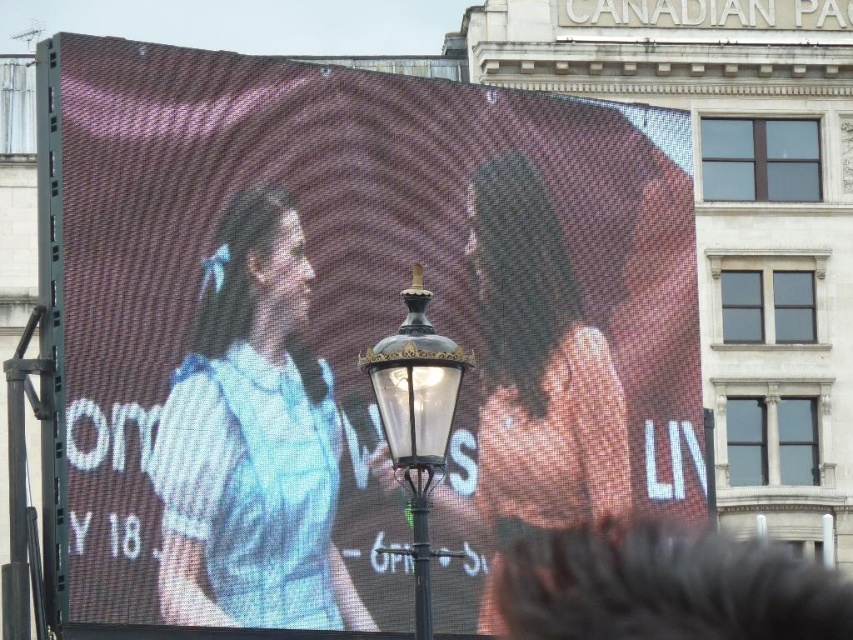
Question: Which object is closer to the camera taking this photo?

Choices:
 (A) smooth skin face at center
 (B) polished brass streetlight at center

Answer: (B)

Question: Does smooth skin face at center come in front of polished brass streetlight at center?

Choices:
 (A) yes
 (B) no

Answer: (B)

Question: Which point is closer to the camera taking this photo?

Choices:
 (A) (231, 173)
 (B) (230, 368)

Answer: (B)

Question: Can you confirm if blue cotton shirt at left is positioned to the left of polished brass streetlight at center?

Choices:
 (A) no
 (B) yes

Answer: (B)

Question: Is blue cotton shirt at left to the right of smooth skin face at center from the viewer's perspective?

Choices:
 (A) yes
 (B) no

Answer: (B)

Question: Among these objects, which one is nearest to the camera?

Choices:
 (A) smooth skin face at center
 (B) pixelated digital billboard at center

Answer: (B)